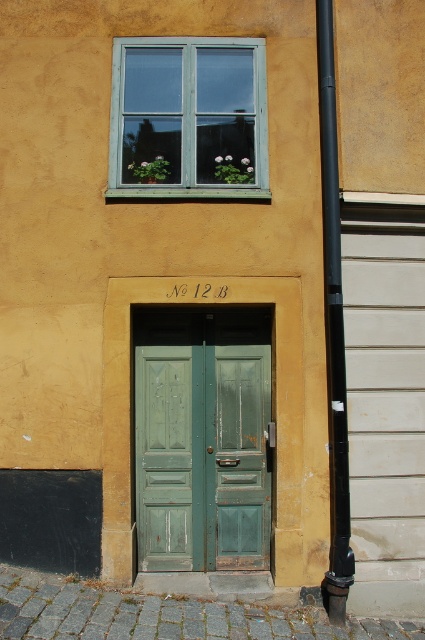
Does teal wooden window at upper center appear on the right side of black matte pipe at right?

Incorrect, teal wooden window at upper center is not on the right side of black matte pipe at right.

What are the coordinates of `teal wooden window at upper center` in the screenshot? It's located at (189, 118).

Image resolution: width=425 pixels, height=640 pixels. Find the location of `green matte door at center`. green matte door at center is located at coordinates (201, 438).

Can you confirm if green matte door at center is positioned to the right of black matte pipe at right?

Incorrect, green matte door at center is not on the right side of black matte pipe at right.

At what (x,y) coordinates should I click in order to perform the action: click on green matte door at center. Please return your answer as a coordinate pair (x, y). The width and height of the screenshot is (425, 640). Looking at the image, I should click on (201, 438).

Which of these two, green matte door at center or teal wooden window at upper center, stands shorter?

teal wooden window at upper center

I want to click on green matte door at center, so click(x=201, y=438).

Locate an element on the screen. The height and width of the screenshot is (640, 425). green matte door at center is located at coordinates (201, 438).